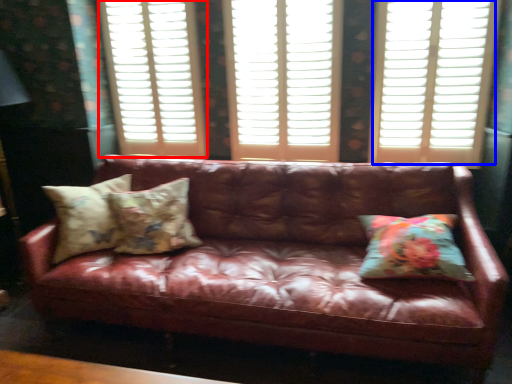
Question: Among these objects, which one is nearest to the camera, window frame (highlighted by a red box) or window (highlighted by a blue box)?

Choices:
 (A) window frame
 (B) window

Answer: (B)